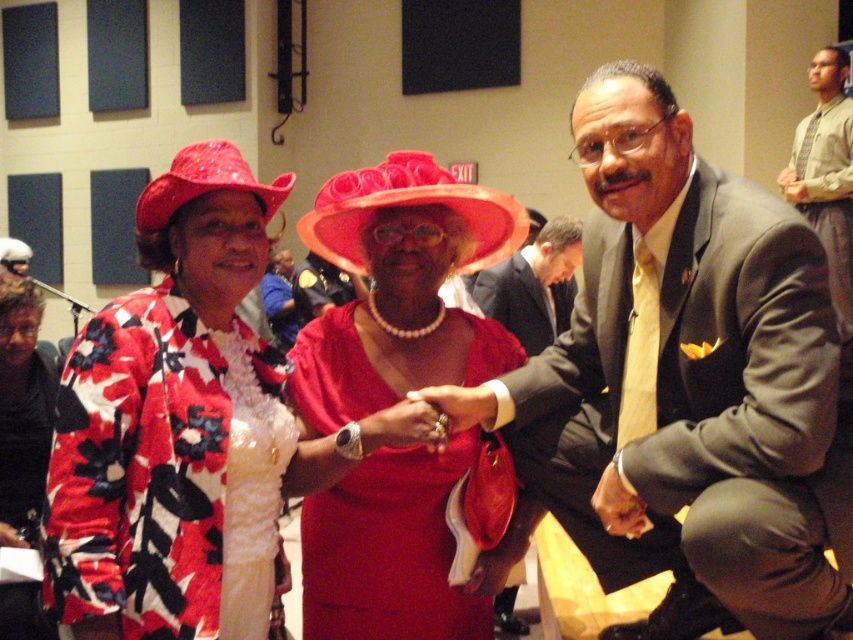
Which of these two, smooth leather hand at center or matte gold ring at center, stands taller?

Standing taller between the two is smooth leather hand at center.

Is point (607, 518) closer to camera compared to point (451, 400)?

Yes, it is.

What do you see at coordinates (618, 504) in the screenshot? This screenshot has height=640, width=853. I see `smooth leather hand at center` at bounding box center [618, 504].

Identify the location of smooth leather hand at center. (618, 504).

Based on the photo, between matte black suit at center and smooth leather hand at center, which one has less height?

smooth leather hand at center

Does matte black suit at center have a larger size compared to smooth leather hand at center?

Yes.

Does point (515, 291) come in front of point (640, 520)?

No, (515, 291) is further to viewer.

Where is `matte black suit at center`? This screenshot has width=853, height=640. matte black suit at center is located at coordinates (532, 282).

Between light beige textured suit at right and matte red hat at center, which one has more height?

light beige textured suit at right

Which is above, light beige textured suit at right or matte red hat at center?

light beige textured suit at right

This screenshot has height=640, width=853. What do you see at coordinates (827, 172) in the screenshot? I see `light beige textured suit at right` at bounding box center [827, 172].

At what (x,y) coordinates should I click in order to perform the action: click on light beige textured suit at right. Please return your answer as a coordinate pair (x, y). The image size is (853, 640). Looking at the image, I should click on [x=827, y=172].